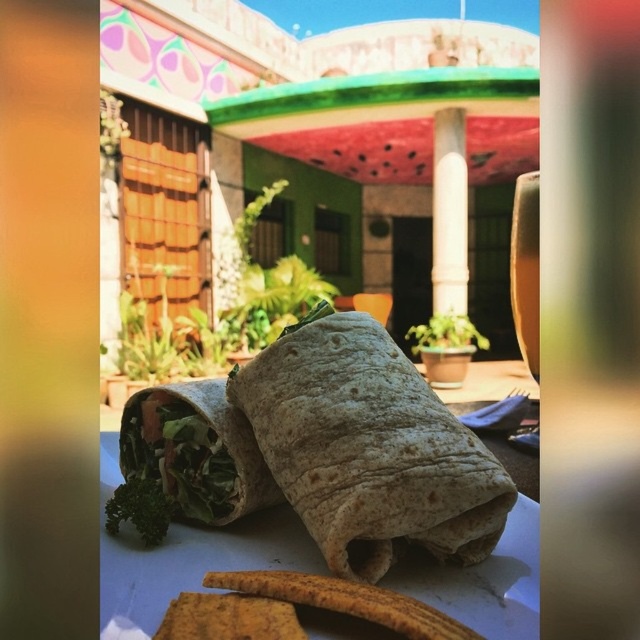
You are a delivery person who needs to place a package on the white paper plate at center. The package is 18 inches long. Will it fit on the plate without touching the white smooth pillar at center?

The white paper plate at center is 17.80 inches away from the white smooth pillar at center. Since the package is 18 inches long, it will extend beyond the space between them and touch the white smooth pillar at center.